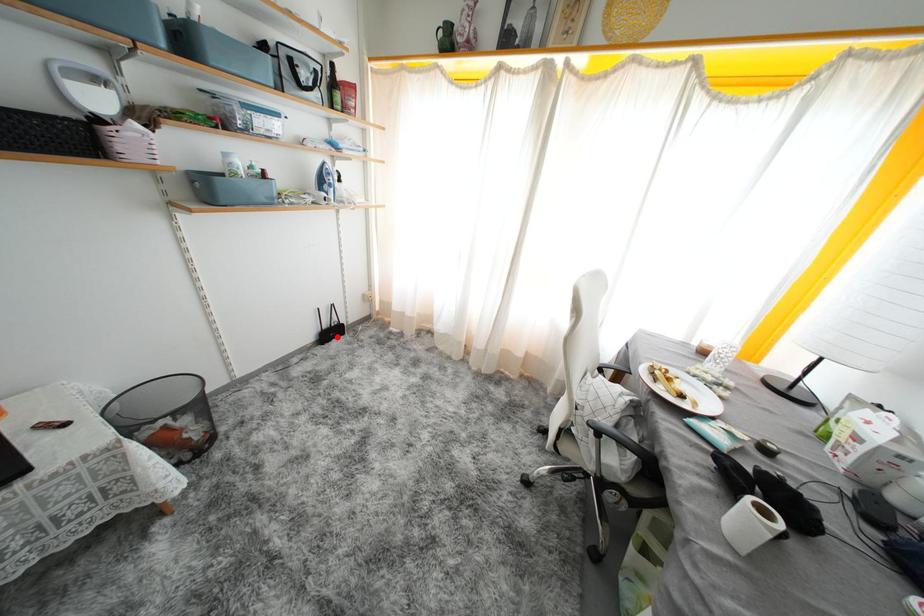
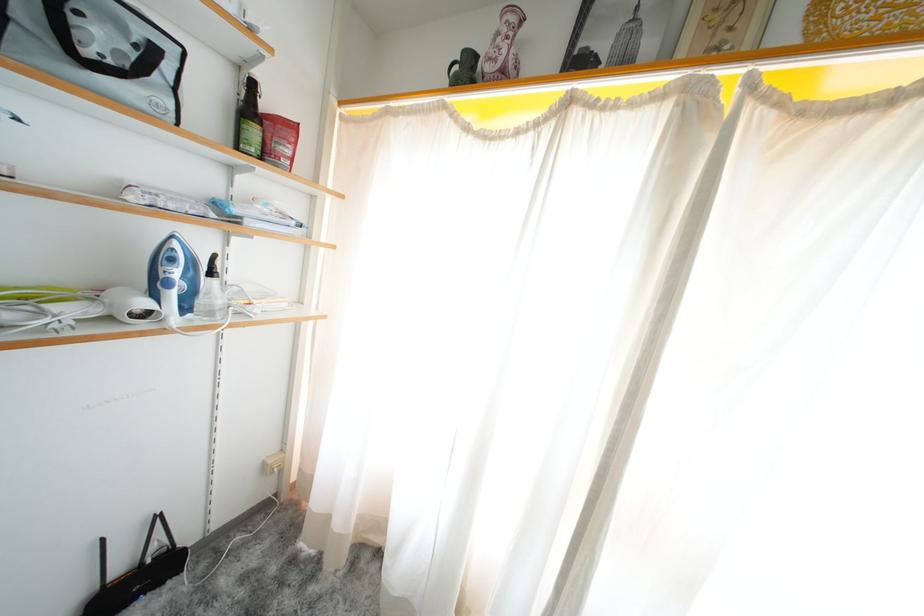
Where in the second image is the point corresponding to the highlighted location from the first image?

(143, 586)